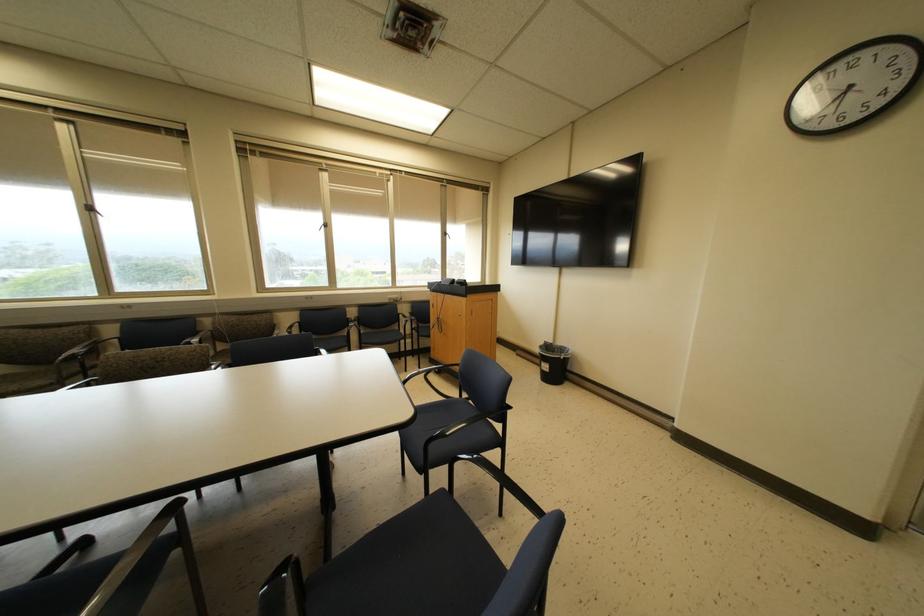
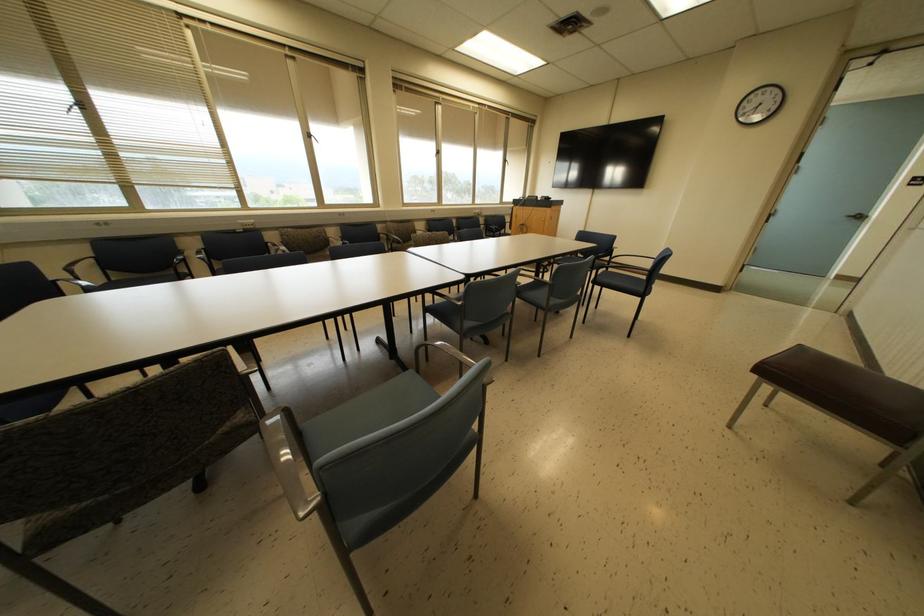
What movement of the cameraman would produce the second image?

The movement direction of the cameraman is left, backward.